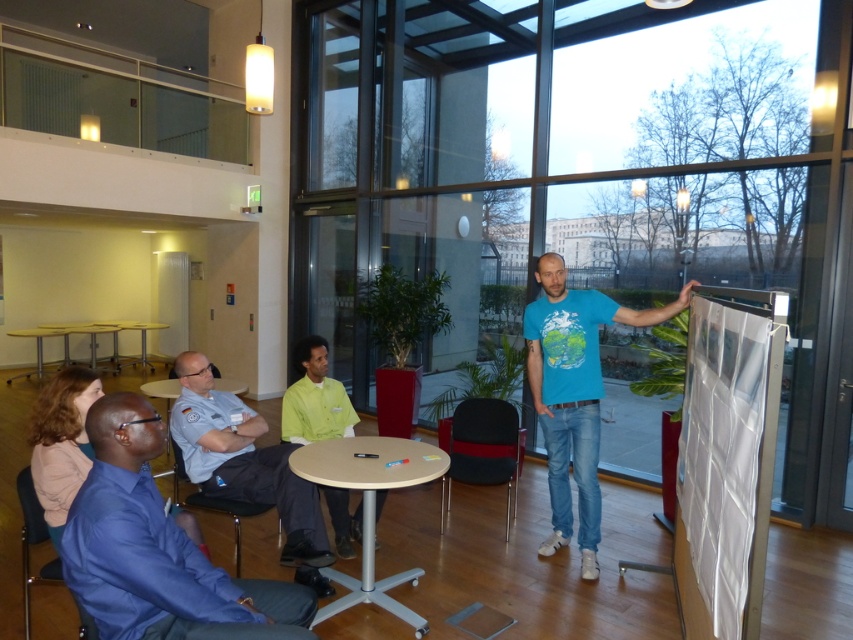
Question: Which point is farther to the camera?

Choices:
 (A) light blue uniform at center
 (B) matte metal table at lower left

Answer: (B)

Question: Which of these objects is positioned farthest from the light green fabric shirt at center?

Choices:
 (A) light brown wooden table at center
 (B) matte metal table at lower left
 (C) matte blue t-shirt at center

Answer: (B)

Question: Is wooden table at center smaller than matte plastic table at center?

Choices:
 (A) yes
 (B) no

Answer: (A)

Question: Which object is closer to the camera taking this photo?

Choices:
 (A) blue fabric shirt at lower left
 (B) light blue uniform at center

Answer: (A)

Question: Can you confirm if light brown wooden table at center is bigger than matte metal table at lower left?

Choices:
 (A) yes
 (B) no

Answer: (B)

Question: From the image, what is the correct spatial relationship of blue fabric shirt at lower left in relation to light blue uniform at center?

Choices:
 (A) above
 (B) below

Answer: (A)